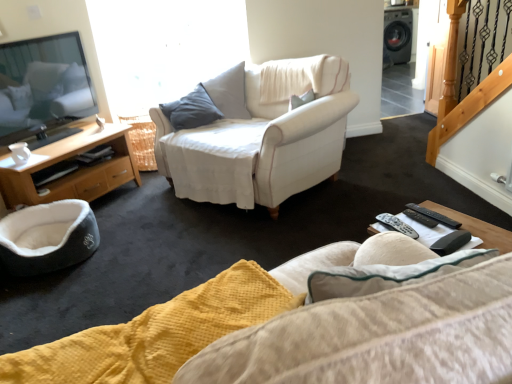
I want to click on free spot to the right of wooden cabinet at left, so click(x=143, y=207).